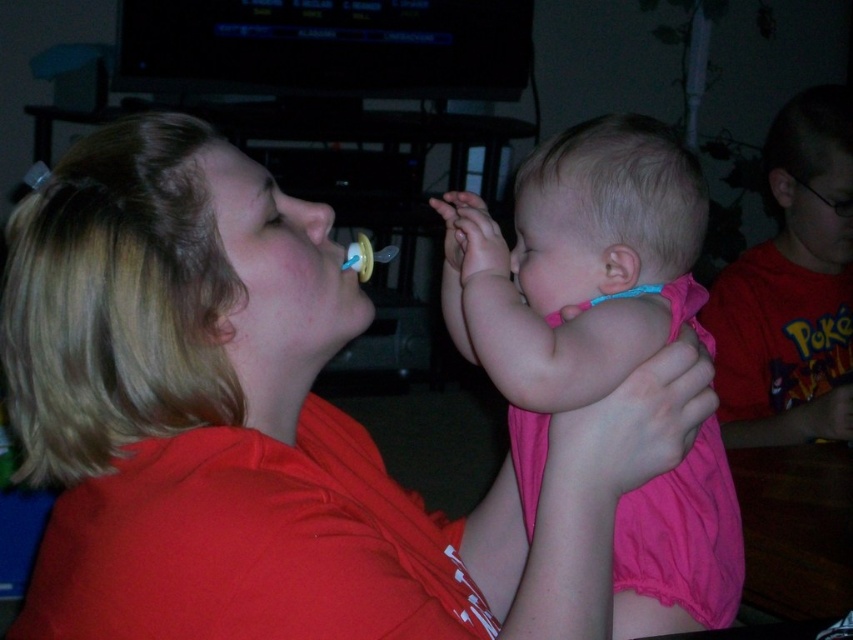
Question: Does matte red shirt at center appear under pink fabric shirt at right?

Choices:
 (A) no
 (B) yes

Answer: (B)

Question: Is pink fabric shirt at right closer to camera compared to yellow rubber baby bottle at center?

Choices:
 (A) yes
 (B) no

Answer: (B)

Question: Which of the following is the farthest from the observer?

Choices:
 (A) (566, 244)
 (B) (817, 157)

Answer: (B)

Question: Estimate the real-world distances between objects in this image. Which object is closer to the yellow rubber baby bottle at center?

Choices:
 (A) matte red shirt at center
 (B) pink fabric at center
 (C) pink fabric shirt at right

Answer: (A)

Question: Does matte red shirt at center appear under yellow rubber baby bottle at center?

Choices:
 (A) yes
 (B) no

Answer: (A)

Question: Which of these objects is positioned closest to the matte red shirt at center?

Choices:
 (A) pink fabric at center
 (B) pink fabric shirt at right
 (C) yellow rubber baby bottle at center

Answer: (A)